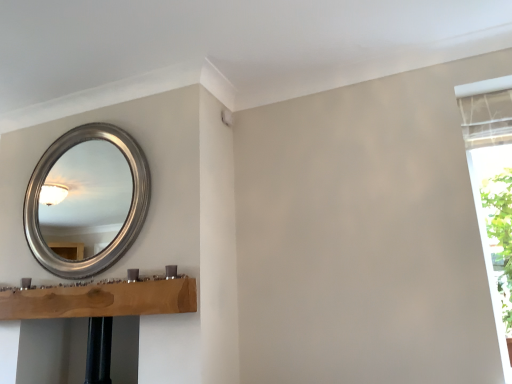
Image resolution: width=512 pixels, height=384 pixels. What do you see at coordinates (88, 196) in the screenshot? I see `silver metallic mirror at upper left` at bounding box center [88, 196].

Locate an element on the screen. This screenshot has height=384, width=512. silver metallic mirror at upper left is located at coordinates click(88, 196).

The image size is (512, 384). Describe the element at coordinates (492, 189) in the screenshot. I see `white fabric curtain at right` at that location.

Where is `white fabric curtain at right`? This screenshot has height=384, width=512. white fabric curtain at right is located at coordinates (492, 189).

What is the approximate height of white fabric curtain at right?

1.44 meters.

At what (x,y) coordinates should I click in order to perform the action: click on silver metallic mirror at upper left. Please return your answer as a coordinate pair (x, y). Image resolution: width=512 pixels, height=384 pixels. Looking at the image, I should click on (88, 196).

Can you confirm if white fabric curtain at right is positioned to the right of silver metallic mirror at upper left?

Indeed, white fabric curtain at right is positioned on the right side of silver metallic mirror at upper left.

Which object is more forward, white fabric curtain at right or silver metallic mirror at upper left?

white fabric curtain at right is more forward.

Considering the points (460, 109) and (101, 246), which point is in front, point (460, 109) or point (101, 246)?

The point (460, 109) is in front.

From the image's perspective, is white fabric curtain at right located above or below silver metallic mirror at upper left?

Clearly, from the image's perspective, white fabric curtain at right is below silver metallic mirror at upper left.

From a real-world perspective, is white fabric curtain at right positioned under silver metallic mirror at upper left based on gravity?

Yes, from a real-world perspective, white fabric curtain at right is under silver metallic mirror at upper left.

Considering the relative sizes of white fabric curtain at right and silver metallic mirror at upper left in the image provided, is white fabric curtain at right thinner than silver metallic mirror at upper left?

Incorrect, the width of white fabric curtain at right is not less than that of silver metallic mirror at upper left.

Considering the sizes of white fabric curtain at right and silver metallic mirror at upper left in the image, is white fabric curtain at right taller or shorter than silver metallic mirror at upper left?

white fabric curtain at right is taller than silver metallic mirror at upper left.

Which of these two, white fabric curtain at right or silver metallic mirror at upper left, is bigger?

With larger size is white fabric curtain at right.

Which is correct: white fabric curtain at right is inside silver metallic mirror at upper left, or outside of it?

white fabric curtain at right lies outside silver metallic mirror at upper left.

Is white fabric curtain at right next to silver metallic mirror at upper left and touching it?

white fabric curtain at right and silver metallic mirror at upper left are not in contact.

Is white fabric curtain at right aimed at silver metallic mirror at upper left?

No.

Where is `mirror located above the white fabric curtain at right (from the image's perspective)`? mirror located above the white fabric curtain at right (from the image's perspective) is located at coordinates (88, 196).

Considering the positions of objects silver metallic mirror at upper left and white fabric curtain at right in the image provided, who is more to the right, silver metallic mirror at upper left or white fabric curtain at right?

white fabric curtain at right is more to the right.

Who is more distant, silver metallic mirror at upper left or white fabric curtain at right?

silver metallic mirror at upper left is further from the camera.

From the picture: Which point is more distant from viewer, (67, 241) or (460, 88)?

Point (67, 241)

From the image's perspective, is silver metallic mirror at upper left above or below white fabric curtain at right?

Based on their image positions, silver metallic mirror at upper left is located above white fabric curtain at right.

From a real-world perspective, is silver metallic mirror at upper left physically below white fabric curtain at right?

Incorrect, from a real-world perspective, silver metallic mirror at upper left is higher than white fabric curtain at right.

Considering the sizes of objects silver metallic mirror at upper left and white fabric curtain at right in the image provided, who is wider, silver metallic mirror at upper left or white fabric curtain at right?

Wider between the two is white fabric curtain at right.

Does silver metallic mirror at upper left have a lesser height compared to white fabric curtain at right?

Indeed, silver metallic mirror at upper left has a lesser height compared to white fabric curtain at right.

Does silver metallic mirror at upper left have a smaller size compared to white fabric curtain at right?

Indeed, silver metallic mirror at upper left has a smaller size compared to white fabric curtain at right.

Is silver metallic mirror at upper left not inside white fabric curtain at right?

Yes, silver metallic mirror at upper left is not within white fabric curtain at right.

Is silver metallic mirror at upper left far away from white fabric curtain at right?

Yes, silver metallic mirror at upper left and white fabric curtain at right are quite far apart.

Is white fabric curtain at right at the back of silver metallic mirror at upper left?

No, white fabric curtain at right is not at the back of silver metallic mirror at upper left.

Can you tell me how much silver metallic mirror at upper left and white fabric curtain at right differ in facing direction?

The facing directions of silver metallic mirror at upper left and white fabric curtain at right are 0.00599 degrees apart.

Identify the location of mirror above the white fabric curtain at right (from a real-world perspective). (88, 196).

Identify the location of mirror that appears above the white fabric curtain at right (from a real-world perspective). (88, 196).

At what (x,y) coordinates should I click in order to perform the action: click on window frame below the silver metallic mirror at upper left (from a real-world perspective). Please return your answer as a coordinate pair (x, y). This screenshot has width=512, height=384. Looking at the image, I should click on [492, 189].